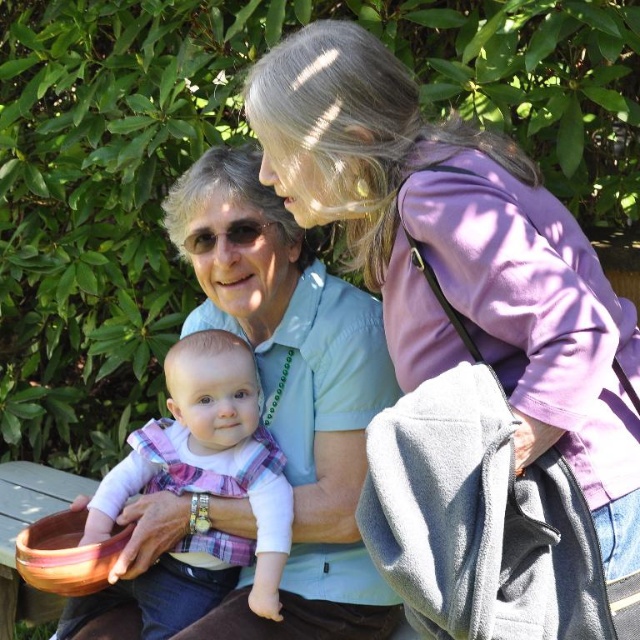
You are standing in the garden and want to take a photo of the two points mentioned. Which point, point (x=236, y=298) or point (x=188, y=451), will appear larger in your camera view?

Point (x=236, y=298) is closer to the camera than point (x=188, y=451), so it will appear larger in the camera view.

You are designing a photo frame that needs to accommodate both the matte blue shirt at center and the plaid fabric baby at center in the image. Based on the spatial relationship between them, which object should be placed on the left side of the frame to ensure they both fit properly?

The matte blue shirt at center should be placed on the left side of the frame because it might be wider than the plaid fabric baby at center, allowing both to fit within the frame without overlapping.

You are a photographer setting up for a family portrait. You need to ensure that the purple matte jacket at upper right and the plaid fabric baby at center are both visible in the frame. Given their sizes, which object might require more careful positioning to avoid being cropped out?

The purple matte jacket at upper right is wider than the plaid fabric baby at center, so it might require more careful positioning to avoid being cropped out due to its larger width.